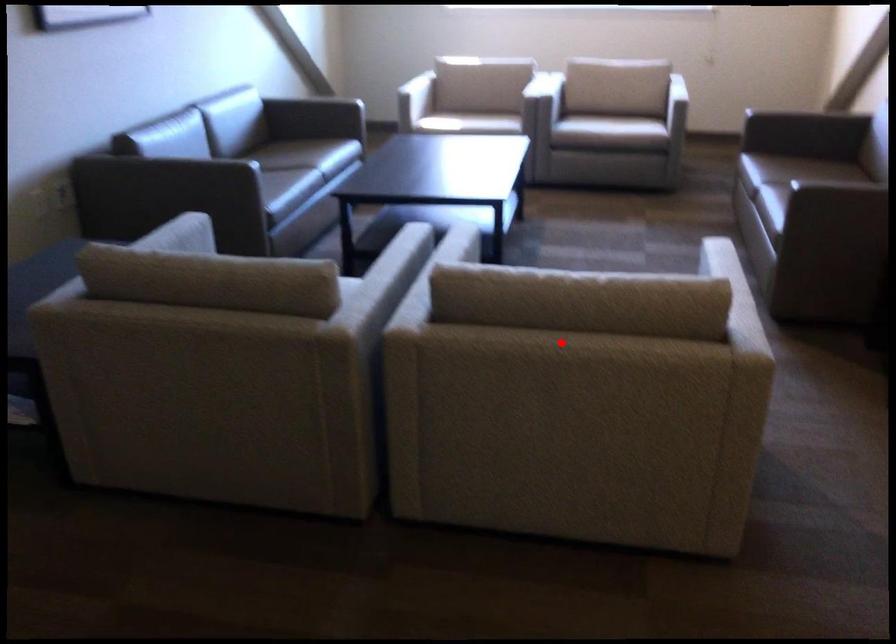
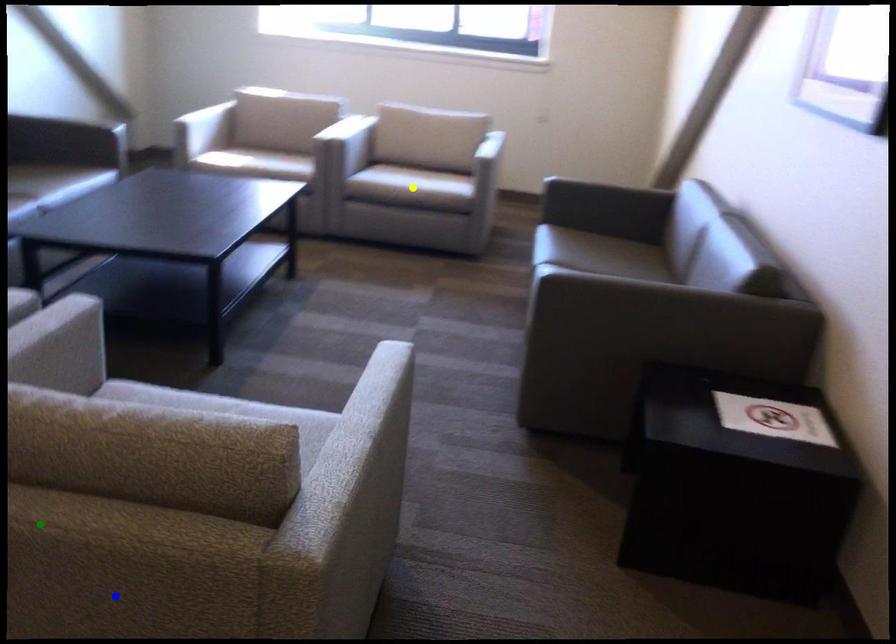
Question: I am providing you with two images of the same scene from different viewpoints. A red point is marked on the first image. You are given multiple points on the second image. In image 2, which mark is for the same physical point as the one in image 1?

Choices:
 (A) green point
 (B) blue point
 (C) yellow point

Answer: (A)